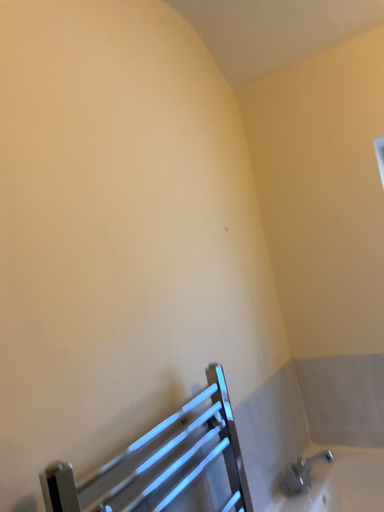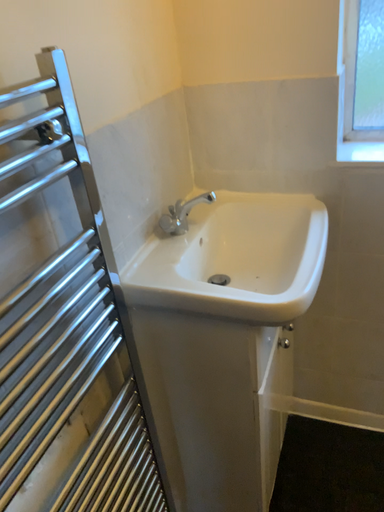
Question: How did the camera likely rotate when shooting the video?

Choices:
 (A) rotated left
 (B) rotated right

Answer: (B)